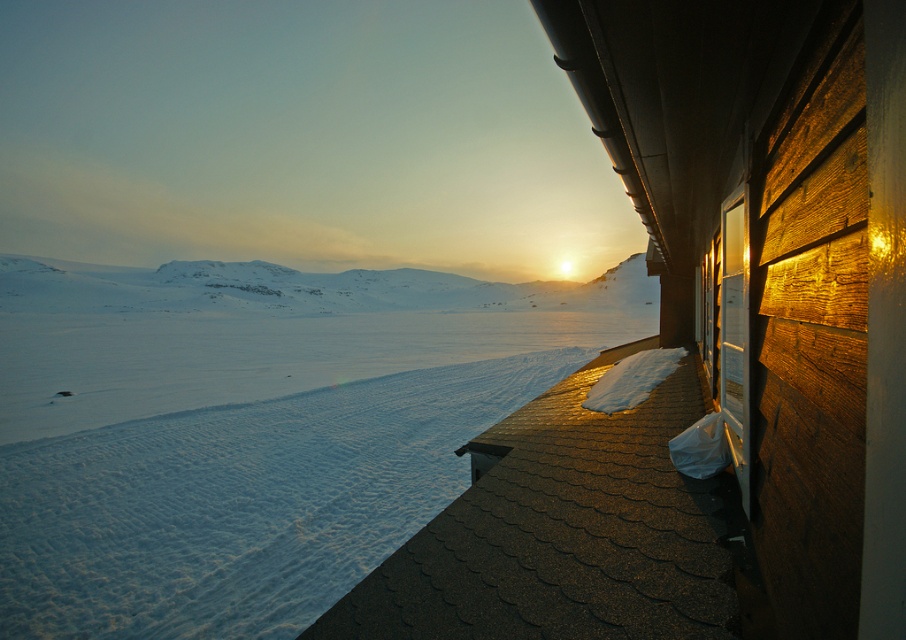
Question: Is snowy white snow at center to the right of white snow-covered mountain at center from the viewer's perspective?

Choices:
 (A) no
 (B) yes

Answer: (B)

Question: Does snowy white snow at center have a greater width compared to white snow-covered mountain at center?

Choices:
 (A) no
 (B) yes

Answer: (A)

Question: Is snowy white snow at center bigger than white snow-covered mountain at center?

Choices:
 (A) yes
 (B) no

Answer: (A)

Question: Which point is closer to the camera taking this photo?

Choices:
 (A) (405, 364)
 (B) (577, 284)

Answer: (A)

Question: Which point is closer to the camera?

Choices:
 (A) pos(287,417)
 (B) pos(373,308)

Answer: (A)